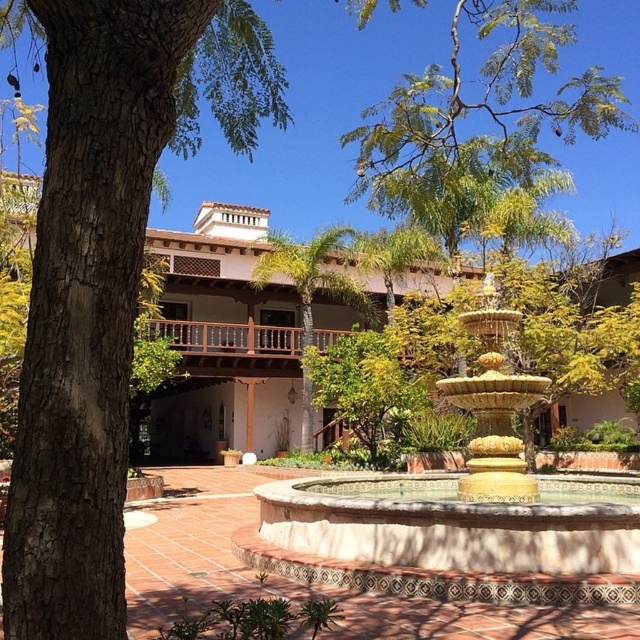
Question: Which object appears farthest from the camera in this image?

Choices:
 (A) gold metallic fountain at center
 (B) green leafy tree at center

Answer: (B)

Question: Is gold metallic fountain at center thinner than green leafy tree at center?

Choices:
 (A) yes
 (B) no

Answer: (B)

Question: Is gold metallic fountain at center closer to the viewer compared to green leafy tree at center?

Choices:
 (A) no
 (B) yes

Answer: (B)

Question: Which point is closer to the camera?

Choices:
 (A) (365, 301)
 (B) (288, 486)

Answer: (B)

Question: Which object appears closest to the camera in this image?

Choices:
 (A) gold metallic fountain at center
 (B) green leafy tree at center

Answer: (A)

Question: Observing the image, what is the correct spatial positioning of gold metallic fountain at center in reference to green leafy tree at center?

Choices:
 (A) below
 (B) above

Answer: (A)